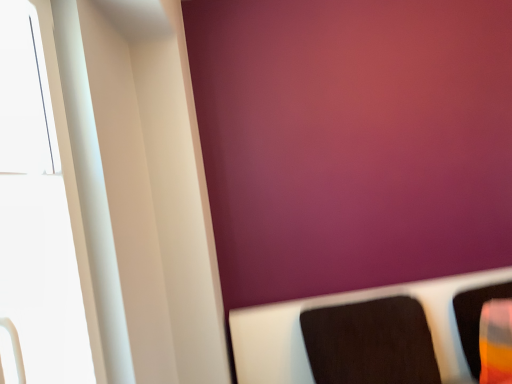
Identify the location of translucent plastic cup at right, which is the second furniture in left-to-right order. (475, 318).

In order to face translucent plastic cup at right, which is the second furniture in left-to-right order, should I rotate leftwards or rightwards?

You should rotate right by 28.801 degrees.

Image resolution: width=512 pixels, height=384 pixels. What are the coordinates of `white glossy window at left` in the screenshot? It's located at (25, 98).

Locate an element on the screen. Image resolution: width=512 pixels, height=384 pixels. window lying above the black fabric cushion at lower right, placed as the 2th furniture when sorted from right to left (from the image's perspective) is located at coordinates (25, 98).

Considering the positions of objects black fabric cushion at lower right, placed as the 2th furniture when sorted from right to left, and white glossy window at left in the image provided, who is more to the left, black fabric cushion at lower right, placed as the 2th furniture when sorted from right to left, or white glossy window at left?

From the viewer's perspective, white glossy window at left appears more on the left side.

From the picture: Would you say black fabric cushion at lower right, placed as the 2th furniture when sorted from right to left, contains white glossy window at left?

No, white glossy window at left is located outside of black fabric cushion at lower right, placed as the 2th furniture when sorted from right to left.

Between black fabric cushion at lower right, which appears as the first furniture when viewed from the left, and white glossy window at left, which one has larger size?

black fabric cushion at lower right, which appears as the first furniture when viewed from the left.

Consider the image. Which is in front, translucent plastic cup at right, which is the second furniture in left-to-right order, or black fabric cushion at lower right, which appears as the first furniture when viewed from the left?

Positioned in front is black fabric cushion at lower right, which appears as the first furniture when viewed from the left.

In terms of size, does translucent plastic cup at right, which is the second furniture in left-to-right order, appear bigger or smaller than black fabric cushion at lower right, which appears as the first furniture when viewed from the left?

translucent plastic cup at right, which is the second furniture in left-to-right order, is smaller than black fabric cushion at lower right, which appears as the first furniture when viewed from the left.

Where is `furniture that is in front of the translucent plastic cup at right, the 1th furniture when ordered from right to left`? furniture that is in front of the translucent plastic cup at right, the 1th furniture when ordered from right to left is located at coordinates click(370, 343).

Can you tell me how much translucent plastic cup at right, the 1th furniture when ordered from right to left, and black fabric cushion at lower right, which appears as the first furniture when viewed from the left, differ in facing direction?

The facing directions of translucent plastic cup at right, the 1th furniture when ordered from right to left, and black fabric cushion at lower right, which appears as the first furniture when viewed from the left, are 3.86 degrees apart.

Is white glossy window at left far away from black fabric cushion at lower right, placed as the 2th furniture when sorted from right to left?

That's right, there is a large distance between white glossy window at left and black fabric cushion at lower right, placed as the 2th furniture when sorted from right to left.

Could you measure the distance between white glossy window at left and black fabric cushion at lower right, which appears as the first furniture when viewed from the left?

white glossy window at left and black fabric cushion at lower right, which appears as the first furniture when viewed from the left, are 1.22 meters apart from each other.

From the image's perspective, which is below, white glossy window at left or black fabric cushion at lower right, which appears as the first furniture when viewed from the left?

black fabric cushion at lower right, which appears as the first furniture when viewed from the left.

From a real-world perspective, who is located higher, white glossy window at left or black fabric cushion at lower right, which appears as the first furniture when viewed from the left?

white glossy window at left, from a real-world perspective.

Which point is more distant from viewer, (458,324) or (7,119)?

The point (458,324) is farther from the camera.

Is translucent plastic cup at right, the 1th furniture when ordered from right to left, positioned beyond the bounds of white glossy window at left?

translucent plastic cup at right, the 1th furniture when ordered from right to left, lies outside white glossy window at left's area.

Could you tell me if translucent plastic cup at right, which is the second furniture in left-to-right order, is facing white glossy window at left?

No, translucent plastic cup at right, which is the second furniture in left-to-right order, is not turned towards white glossy window at left.

In terms of width, does translucent plastic cup at right, the 1th furniture when ordered from right to left, look wider or thinner when compared to white glossy window at left?

In the image, translucent plastic cup at right, the 1th furniture when ordered from right to left, appears to be more narrow than white glossy window at left.

Does point (28, 2) come closer to viewer compared to point (460, 316)?

Yes.

There is a white glossy window at left. In order to click on the 2nd furniture below it (from a real-world perspective) in this screenshot , I will do `click(475, 318)`.

Which object is wider, white glossy window at left or translucent plastic cup at right, the 1th furniture when ordered from right to left?

white glossy window at left is wider.

Considering the points (324, 380) and (511, 295), which point is behind, point (324, 380) or point (511, 295)?

The point (511, 295) is farther from the camera.

Could you tell me if black fabric cushion at lower right, placed as the 2th furniture when sorted from right to left, is turned towards translucent plastic cup at right, which is the second furniture in left-to-right order?

No, black fabric cushion at lower right, placed as the 2th furniture when sorted from right to left, is not aimed at translucent plastic cup at right, which is the second furniture in left-to-right order.

Would you consider black fabric cushion at lower right, placed as the 2th furniture when sorted from right to left, to be distant from translucent plastic cup at right, which is the second furniture in left-to-right order?

Actually, black fabric cushion at lower right, placed as the 2th furniture when sorted from right to left, and translucent plastic cup at right, which is the second furniture in left-to-right order, are a little close together.

Locate an element on the screen. This screenshot has width=512, height=384. window that appears in front of the black fabric cushion at lower right, placed as the 2th furniture when sorted from right to left is located at coordinates (25, 98).

Find the location of `furniture above the translucent plastic cup at right, the 1th furniture when ordered from right to left (from a real-world perspective)`. furniture above the translucent plastic cup at right, the 1th furniture when ordered from right to left (from a real-world perspective) is located at coordinates (370, 343).

From the picture: From the image, which object appears to be nearer to translucent plastic cup at right, the 1th furniture when ordered from right to left, white glossy window at left or black fabric cushion at lower right, which appears as the first furniture when viewed from the left?

black fabric cushion at lower right, which appears as the first furniture when viewed from the left.

Looking at the image, which one is located closer to black fabric cushion at lower right, which appears as the first furniture when viewed from the left, translucent plastic cup at right, the 1th furniture when ordered from right to left, or white glossy window at left?

Among the two, translucent plastic cup at right, the 1th furniture when ordered from right to left, is located nearer to black fabric cushion at lower right, which appears as the first furniture when viewed from the left.

From the image, which object appears to be farther from white glossy window at left, translucent plastic cup at right, the 1th furniture when ordered from right to left, or black fabric cushion at lower right, placed as the 2th furniture when sorted from right to left?

translucent plastic cup at right, the 1th furniture when ordered from right to left, is positioned further to the anchor white glossy window at left.

Estimate the real-world distances between objects in this image. Which object is closer to white glossy window at left, black fabric cushion at lower right, which appears as the first furniture when viewed from the left, or translucent plastic cup at right, the 1th furniture when ordered from right to left?

black fabric cushion at lower right, which appears as the first furniture when viewed from the left, is positioned closer to the anchor white glossy window at left.

Estimate the real-world distances between objects in this image. Which object is further from translucent plastic cup at right, the 1th furniture when ordered from right to left, black fabric cushion at lower right, placed as the 2th furniture when sorted from right to left, or white glossy window at left?

white glossy window at left.

Looking at the image, which one is located further to black fabric cushion at lower right, which appears as the first furniture when viewed from the left, white glossy window at left or translucent plastic cup at right, which is the second furniture in left-to-right order?

The object further to black fabric cushion at lower right, which appears as the first furniture when viewed from the left, is white glossy window at left.

At what (x,y) coordinates should I click in order to perform the action: click on furniture located between white glossy window at left and translucent plastic cup at right, which is the second furniture in left-to-right order, in the left-right direction. Please return your answer as a coordinate pair (x, y). This screenshot has height=384, width=512. Looking at the image, I should click on (370, 343).